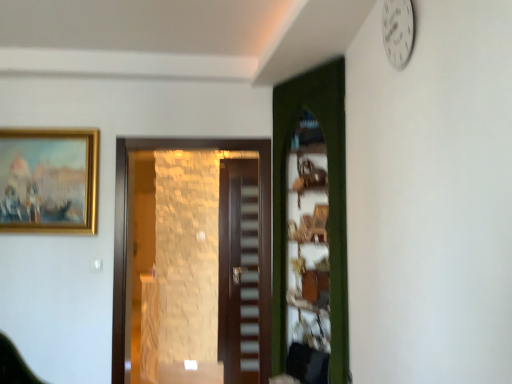
Question: Is brown stone wall at center, which is the second door from back to front, inside green wooden door at center, the 1th door from the right?

Choices:
 (A) yes
 (B) no

Answer: (B)

Question: From the image's perspective, is green wooden door at center, the third door in the back-to-front sequence, located beneath brown stone wall at center, the 1th door when ordered from left to right?

Choices:
 (A) no
 (B) yes

Answer: (A)

Question: From a real-world perspective, is green wooden door at center, the 1th door from the right, beneath brown stone wall at center, the 1th door when ordered from left to right?

Choices:
 (A) no
 (B) yes

Answer: (A)

Question: Would you say green wooden door at center, the third door in the back-to-front sequence, is outside brown stone wall at center, the third door positioned from the right?

Choices:
 (A) yes
 (B) no

Answer: (A)

Question: Is green wooden door at center, the 1th door from the right, with brown stone wall at center, the third door positioned from the right?

Choices:
 (A) yes
 (B) no

Answer: (B)

Question: Does green wooden door at center, which is the 1th door from front to back, have a smaller size compared to brown stone wall at center, the third door positioned from the right?

Choices:
 (A) yes
 (B) no

Answer: (B)

Question: Is gold-framed painting at upper left further to the viewer compared to white plastic clock at upper right?

Choices:
 (A) no
 (B) yes

Answer: (B)

Question: Are gold-framed painting at upper left and white plastic clock at upper right far apart?

Choices:
 (A) no
 (B) yes

Answer: (B)

Question: Would you say gold-framed painting at upper left contains white plastic clock at upper right?

Choices:
 (A) no
 (B) yes

Answer: (A)

Question: Can you confirm if gold-framed painting at upper left is smaller than white plastic clock at upper right?

Choices:
 (A) no
 (B) yes

Answer: (A)

Question: Can you confirm if gold-framed painting at upper left is taller than white plastic clock at upper right?

Choices:
 (A) no
 (B) yes

Answer: (B)

Question: Is gold-framed painting at upper left oriented away from white plastic clock at upper right?

Choices:
 (A) no
 (B) yes

Answer: (A)

Question: Is the depth of brown stone wall at center, the third door positioned from the right, greater than that of gold-framed painting at upper left?

Choices:
 (A) no
 (B) yes

Answer: (A)